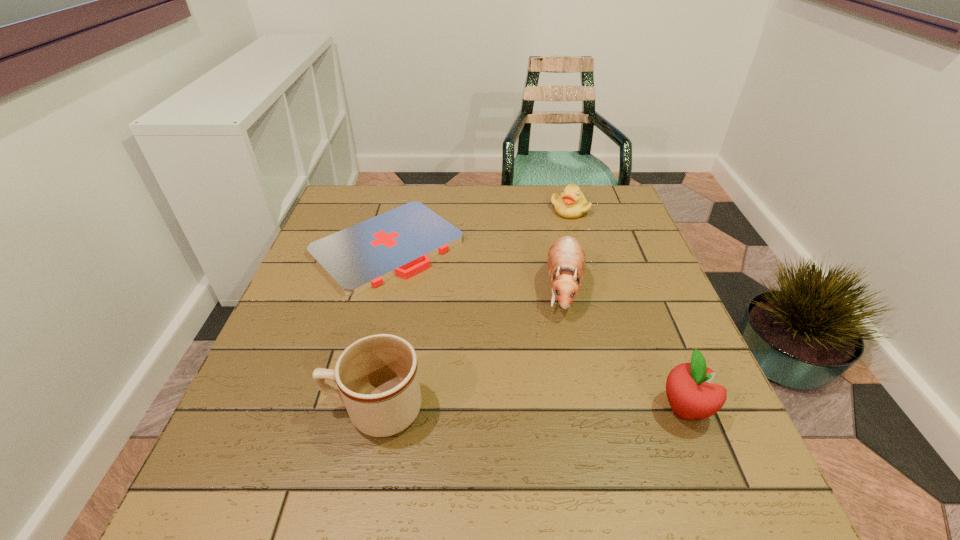
I want to click on free spot located on handle side the shortest object, so click(470, 316).

You are a GUI agent. You are given a task and a screenshot of the screen. Output one action in this format:
    pyautogui.click(x=<x>, y=<y>)
    Task: Click on the vacant space located at the face of the fourth tallest object
    The height and width of the screenshot is (540, 960).
    Given the screenshot: What is the action you would take?
    pyautogui.click(x=565, y=293)

Identify the location of vacant area located 0.250m at the face of the fourth tallest object. (566, 274).

Locate an element on the screen. vacant space situated 0.260m at the face of the fourth tallest object is located at coordinates (565, 276).

Find the location of a particular element. blank space located 0.240m at the face of the hamster is located at coordinates (548, 413).

You are a GUI agent. You are given a task and a screenshot of the screen. Output one action in this format:
    pyautogui.click(x=<x>, y=<y>)
    Task: Click on the vacant space located at the face of the hamster
    
    Given the screenshot: What is the action you would take?
    pyautogui.click(x=554, y=382)

I want to click on vacant area situated 0.250m at the face of the hamster, so click(x=547, y=417).

The width and height of the screenshot is (960, 540). What are the coordinates of `the first-aid kit that is positioned at the far edge` in the screenshot? It's located at (400, 242).

Locate an element on the screen. duckling positioned at the far edge is located at coordinates (571, 204).

At what (x,y) coordinates should I click in order to perform the action: click on mug that is at the near edge. Please return your answer as a coordinate pair (x, y). Looking at the image, I should click on (377, 376).